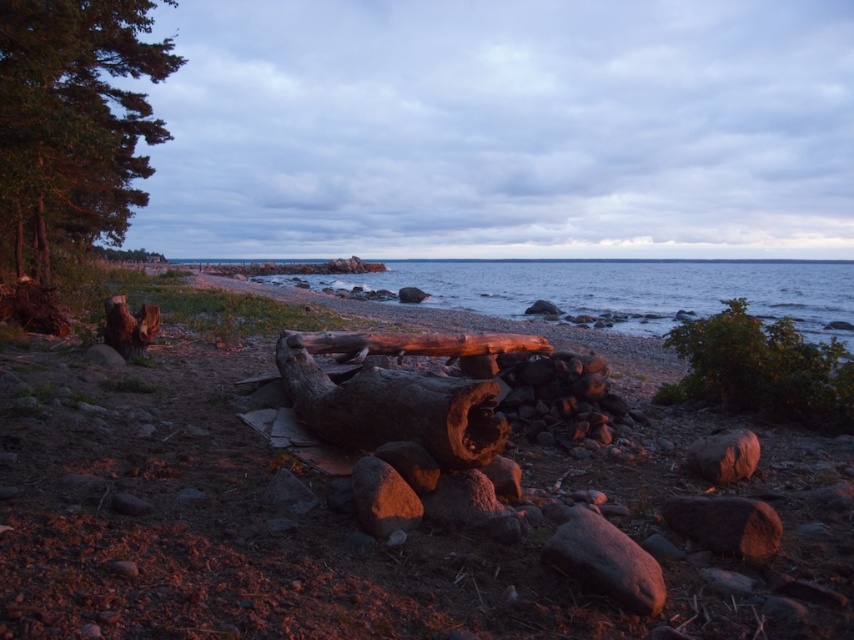
You are standing in the coastal scene and want to place a small decorative rock between the smooth brown log at center and the green leafy bush at right. Based on their positions, which object should the rock be nearer to?

The smooth brown log at center is closer to the viewer than the green leafy bush at right, so the rock should be placed nearer to the green leafy bush at right to be between them.

You are standing at the center of the image and want to place a small red flag exactly at the location of the smooth brown log at center. According to the coordinates provided, where should you place the flag?

The smooth brown log at center is located at coordinates point (372, 529), so you should place the small red flag at that exact point.